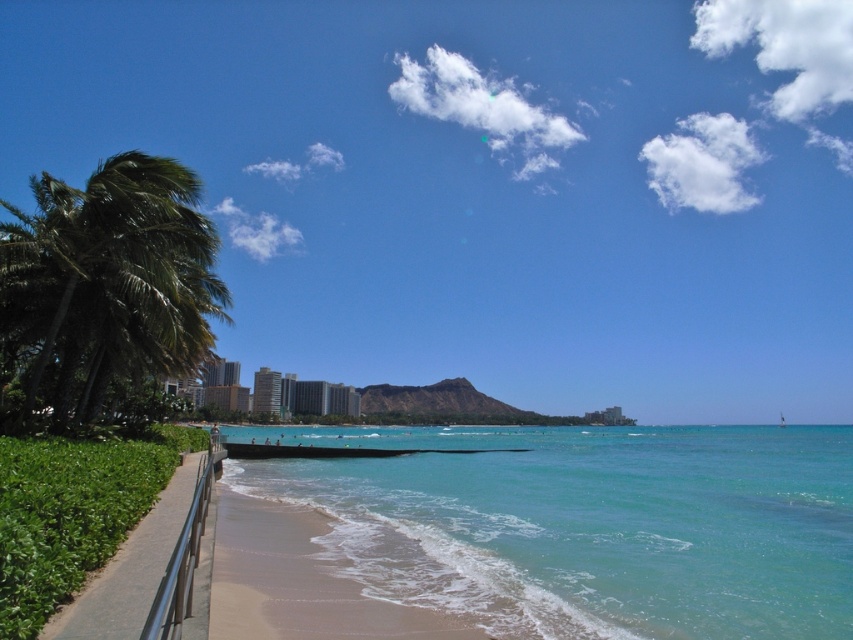
Question: Which point is farther to the camera?

Choices:
 (A) [x=756, y=499]
 (B) [x=173, y=196]

Answer: (A)

Question: Which is nearer to the transparent blue sky at upper center?

Choices:
 (A) light brown sand at lower center
 (B) clear blue water at lower center

Answer: (B)

Question: Is clear blue water at lower center to the left of green leafy palm tree at left from the viewer's perspective?

Choices:
 (A) yes
 (B) no

Answer: (B)

Question: Which point is farther to the camera?

Choices:
 (A) transparent blue sky at upper center
 (B) green leafy palm tree at left

Answer: (A)

Question: Can you confirm if transparent blue sky at upper center is smaller than green leafy palm tree at left?

Choices:
 (A) no
 (B) yes

Answer: (A)

Question: Is transparent blue sky at upper center thinner than light brown sand at lower center?

Choices:
 (A) no
 (B) yes

Answer: (A)